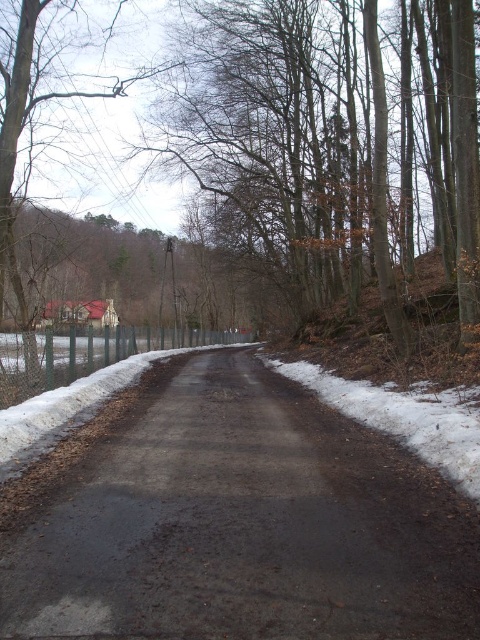
Can you confirm if brown/dry wood at center is positioned to the right of white powdery snow at right?

Indeed, brown/dry wood at center is positioned on the right side of white powdery snow at right.

Does point (349, 109) come behind point (328, 374)?

Yes, point (349, 109) is farther from viewer.

Describe the element at coordinates (288, 141) in the screenshot. I see `brown/dry wood at center` at that location.

The image size is (480, 640). I want to click on brown/dry wood at center, so [x=288, y=141].

Does brown/dry wood at center appear on the right side of green metallic fence at left?

Yes, brown/dry wood at center is to the right of green metallic fence at left.

Is point (283, 131) positioned before point (122, 355)?

No, it is not.

Describe the element at coordinates (288, 141) in the screenshot. The width and height of the screenshot is (480, 640). I see `brown/dry wood at center` at that location.

I want to click on brown/dry wood at center, so click(288, 141).

Does white powdery snow at right have a greater height compared to green metallic fence at left?

No, white powdery snow at right is not taller than green metallic fence at left.

Which is behind, point (427, 451) or point (216, 332)?

Point (216, 332)

At what (x,y) coordinates should I click in order to perform the action: click on white powdery snow at right. Please return your answer as a coordinate pair (x, y). The image size is (480, 640). Looking at the image, I should click on (403, 419).